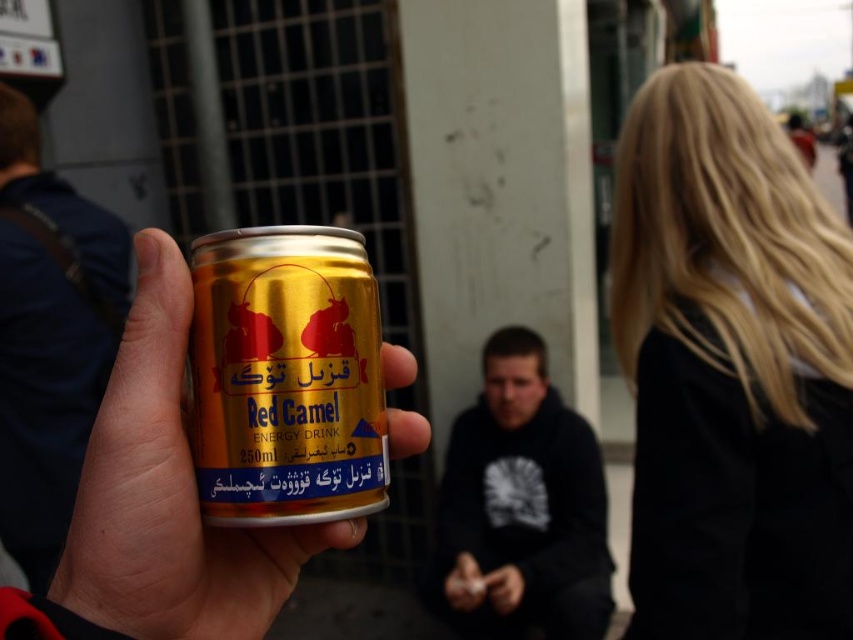
You are a delivery person who needs to place the gold metallic can at center into a storage box located at coordinates 0.589, 0.335. Can you confirm if the can is already positioned correctly?

The gold metallic can at center is already positioned at point [285,376], so it is correctly placed in the storage box.

You are a photographer trying to capture the metallic gold can at left and the dark blue hoodie at center in the same frame. Based on their positions, which object should you adjust your camera to focus on first if you want to ensure both are in the shot?

The metallic gold can at left is to the left of dark blue hoodie at center, so you should focus on the dark blue hoodie at center first as it is closer to the center of the frame, ensuring both objects remain in the shot.